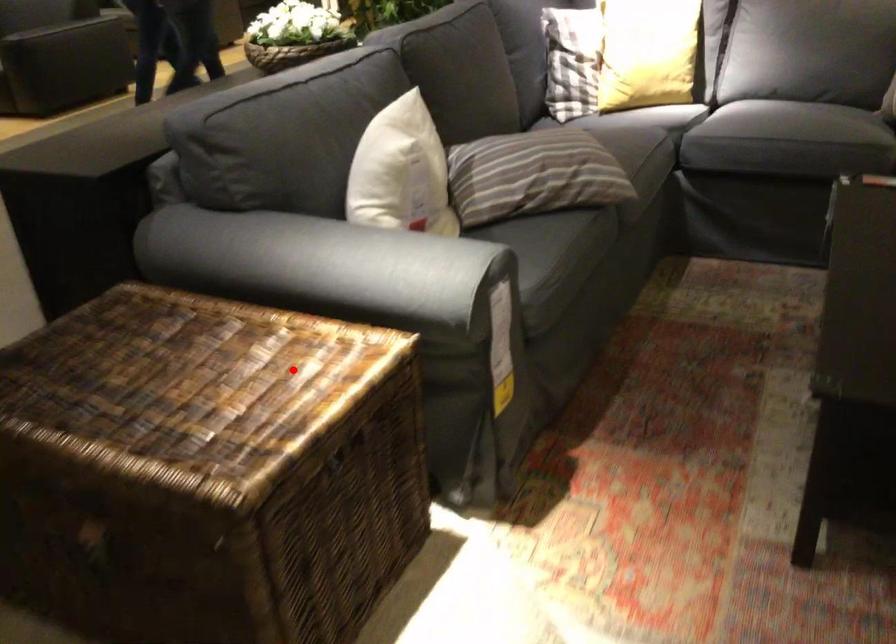
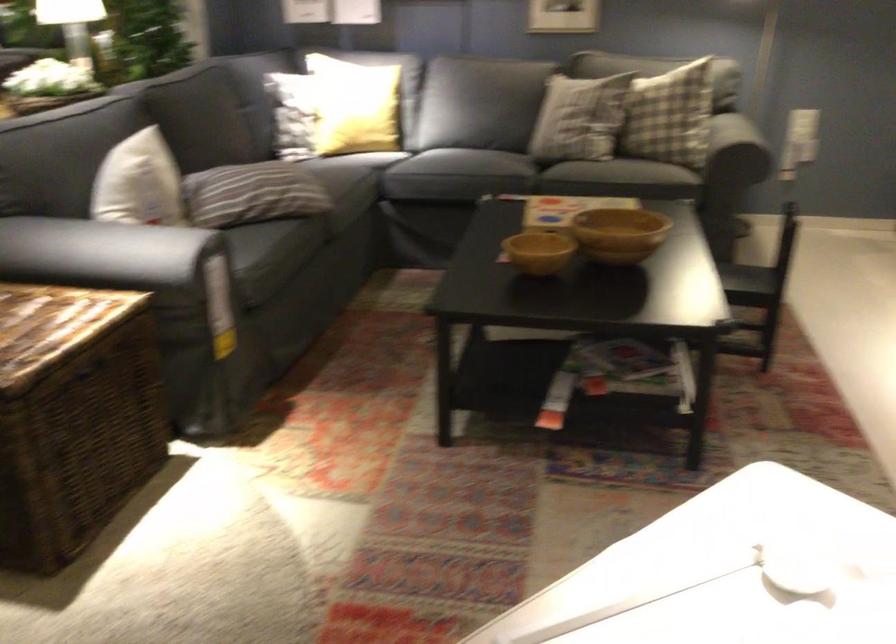
Question: A red point is marked in image1. In image2, is the corresponding 3D point closer to the camera or farther? Reply with the corresponding letter.

Choices:
 (A) The corresponding 3D point is closer.
 (B) The corresponding 3D point is farther.

Answer: (B)